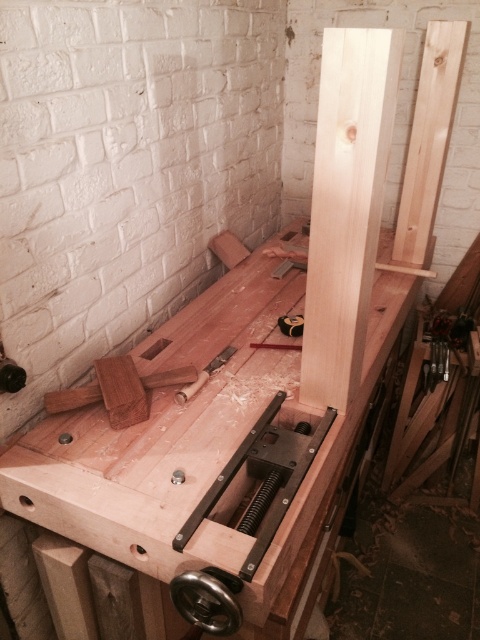
You are a carpenter who needs to move a 15 inch long tool from the natural wood workbench at center to the natural wood beam at center. Is there enough space between them to slide the tool without lifting it?

The natural wood workbench at center and natural wood beam at center are 15.56 inches apart from each other. Since the tool is 15 inches long, there is enough space to slide it without lifting.

Based on the photo, you are organizing tools in a workshop and need to place a new tool between the natural wood workbench at center and the natural wood beam at center. Based on their positions, which object should you place the tool closer to if you want it to be on the left side of the beam?

You should place the tool closer to the natural wood workbench at center because it is already positioned to the left of the natural wood beam at center.

You are a carpenter working in the workshop. You need to place a new tool exactly at the point labeled point (204, 449). Where should you place it?

The point (204, 449) is located on the natural wood workbench at center, so you should place the new tool on the natural wood workbench at center.